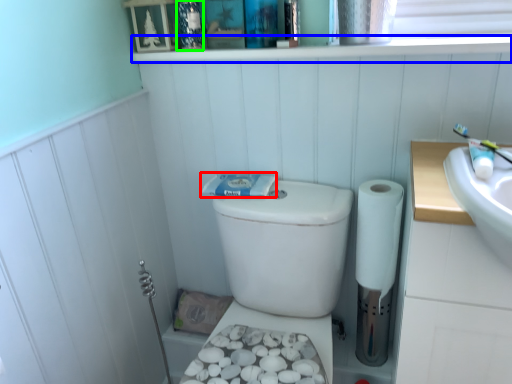
Question: Which object is positioned closest to toothpaste (highlighted by a red box)? Select from ledge (highlighted by a blue box) and toiletry (highlighted by a green box).

Choices:
 (A) ledge
 (B) toiletry

Answer: (A)